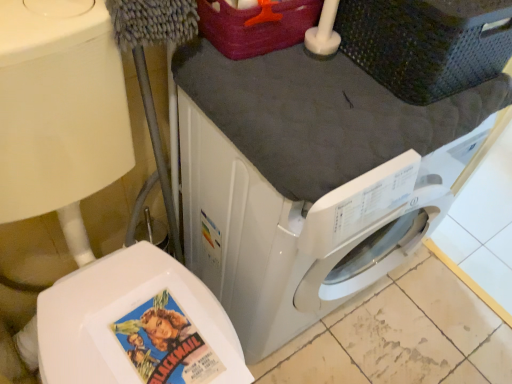
This screenshot has height=384, width=512. I want to click on vacant area that is in front of dark gray plastic basket at upper right, so click(355, 124).